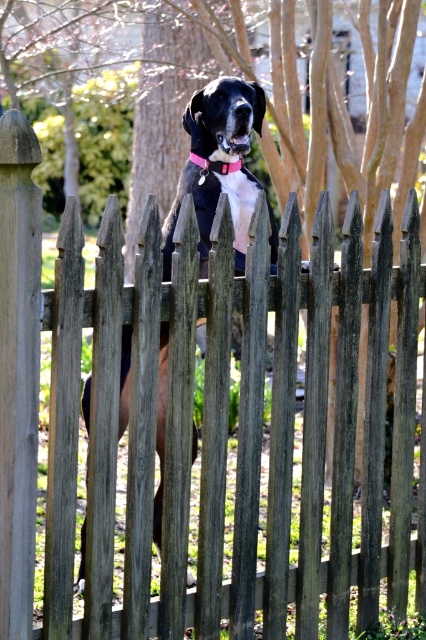
Question: Is black matte dog at center further to camera compared to pink fabric neckband at center?

Choices:
 (A) no
 (B) yes

Answer: (A)

Question: Can you confirm if black matte dog at center is smaller than pink fabric neckband at center?

Choices:
 (A) no
 (B) yes

Answer: (A)

Question: Which point is closer to the camera taking this photo?

Choices:
 (A) (203, 172)
 (B) (161, 234)

Answer: (B)

Question: From the image, what is the correct spatial relationship of black matte dog at center in relation to pink fabric neckband at center?

Choices:
 (A) above
 (B) below

Answer: (B)

Question: Which object appears closest to the camera in this image?

Choices:
 (A) pink fabric neckband at center
 (B) black matte dog at center

Answer: (B)